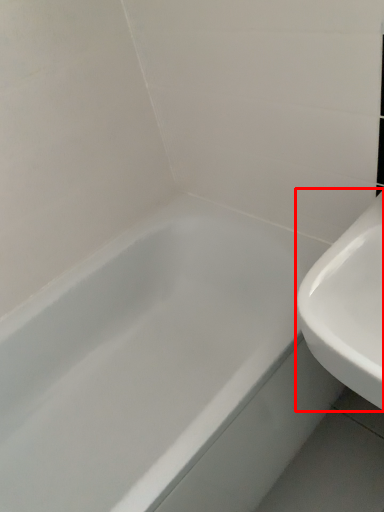
Question: Observing the image, what is the correct spatial positioning of sink (annotated by the red box) in reference to bathtub?

Choices:
 (A) right
 (B) left

Answer: (A)